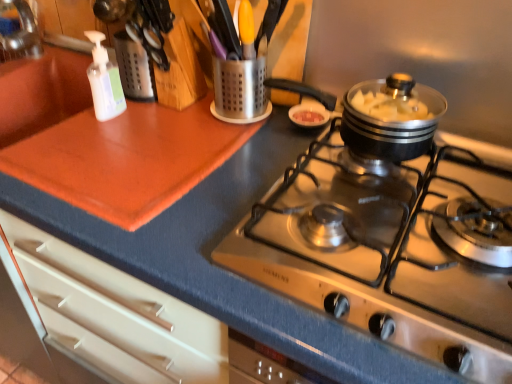
Where is `vacant area that is in front of metallic utensil holder at upper center`? vacant area that is in front of metallic utensil holder at upper center is located at coordinates (198, 148).